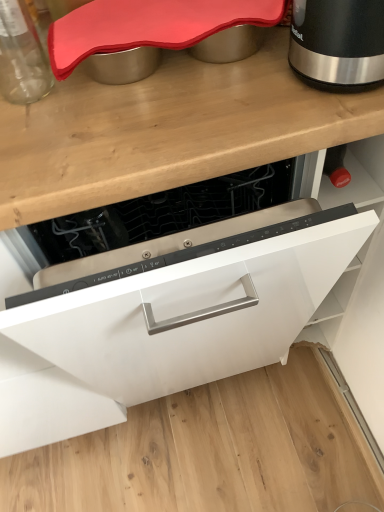
Question: Considering the relative sizes of black metallic kettle at upper right and white matte cabinet at center in the image provided, is black metallic kettle at upper right smaller than white matte cabinet at center?

Choices:
 (A) no
 (B) yes

Answer: (B)

Question: Does black metallic kettle at upper right appear on the left side of white matte cabinet at center?

Choices:
 (A) no
 (B) yes

Answer: (A)

Question: Is black metallic kettle at upper right directly adjacent to white matte cabinet at center?

Choices:
 (A) yes
 (B) no

Answer: (B)

Question: Is black metallic kettle at upper right outside white matte cabinet at center?

Choices:
 (A) yes
 (B) no

Answer: (A)

Question: Does black metallic kettle at upper right have a lesser height compared to white matte cabinet at center?

Choices:
 (A) no
 (B) yes

Answer: (B)

Question: Choose the correct answer: Is transparent glass jar at upper left inside black metallic kettle at upper right or outside it?

Choices:
 (A) outside
 (B) inside

Answer: (A)

Question: In terms of size, does transparent glass jar at upper left appear bigger or smaller than black metallic kettle at upper right?

Choices:
 (A) big
 (B) small

Answer: (A)

Question: In terms of height, does transparent glass jar at upper left look taller or shorter compared to black metallic kettle at upper right?

Choices:
 (A) tall
 (B) short

Answer: (A)

Question: Is transparent glass jar at upper left wider or thinner than black metallic kettle at upper right?

Choices:
 (A) wide
 (B) thin

Answer: (A)

Question: In terms of width, does transparent glass jar at upper left look wider or thinner when compared to white matte cabinet at center?

Choices:
 (A) wide
 (B) thin

Answer: (B)

Question: Is transparent glass jar at upper left to the left or to the right of white matte cabinet at center in the image?

Choices:
 (A) left
 (B) right

Answer: (A)

Question: Would you say transparent glass jar at upper left is inside or outside white matte cabinet at center?

Choices:
 (A) inside
 (B) outside

Answer: (B)

Question: Is point (18, 92) positioned closer to the camera than point (307, 291)?

Choices:
 (A) closer
 (B) farther

Answer: (A)

Question: Is white matte cabinet at center inside or outside of black metallic kettle at upper right?

Choices:
 (A) outside
 (B) inside

Answer: (A)

Question: Considering the relative positions of white matte cabinet at center and black metallic kettle at upper right in the image provided, is white matte cabinet at center to the left or to the right of black metallic kettle at upper right?

Choices:
 (A) left
 (B) right

Answer: (A)